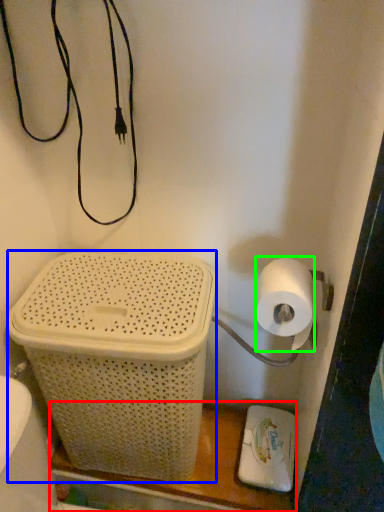
Question: Considering the real-world distances, which object is closest to shelf (highlighted by a red box)? basket container (highlighted by a blue box) or toilet paper (highlighted by a green box).

Choices:
 (A) basket container
 (B) toilet paper

Answer: (A)